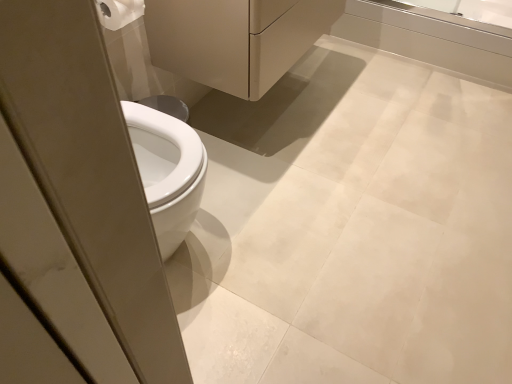
Question: Is transparent glass screen door at left with matte white porcelain at center?

Choices:
 (A) no
 (B) yes

Answer: (A)

Question: Is transparent glass screen door at left shorter than matte white porcelain at center?

Choices:
 (A) no
 (B) yes

Answer: (A)

Question: Is matte white porcelain at center at the back of transparent glass screen door at left?

Choices:
 (A) no
 (B) yes

Answer: (A)

Question: From the image's perspective, does transparent glass screen door at left appear higher than matte white porcelain at center?

Choices:
 (A) yes
 (B) no

Answer: (B)

Question: Would you say transparent glass screen door at left is a long distance from matte white porcelain at center?

Choices:
 (A) no
 (B) yes

Answer: (B)

Question: Can you confirm if transparent glass screen door at left is taller than matte white porcelain at center?

Choices:
 (A) yes
 (B) no

Answer: (A)

Question: Can you confirm if white glossy bathtub at upper right is wider than transparent glass screen door at left?

Choices:
 (A) yes
 (B) no

Answer: (B)

Question: From a real-world perspective, is white glossy bathtub at upper right on top of transparent glass screen door at left?

Choices:
 (A) no
 (B) yes

Answer: (A)

Question: Is the surface of white glossy bathtub at upper right in direct contact with transparent glass screen door at left?

Choices:
 (A) yes
 (B) no

Answer: (B)

Question: Could you tell me if white glossy bathtub at upper right is turned towards transparent glass screen door at left?

Choices:
 (A) yes
 (B) no

Answer: (A)

Question: Considering the relative positions of white glossy bathtub at upper right and transparent glass screen door at left in the image provided, is white glossy bathtub at upper right to the right of transparent glass screen door at left from the viewer's perspective?

Choices:
 (A) yes
 (B) no

Answer: (A)

Question: Is there a large distance between white glossy bathtub at upper right and transparent glass screen door at left?

Choices:
 (A) yes
 (B) no

Answer: (A)

Question: Can you confirm if matte white porcelain at center is positioned to the right of white glossy bathtub at upper right?

Choices:
 (A) no
 (B) yes

Answer: (A)